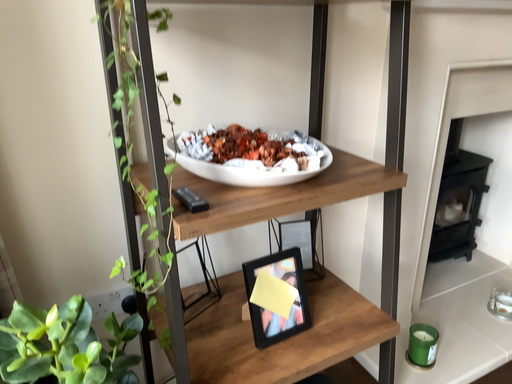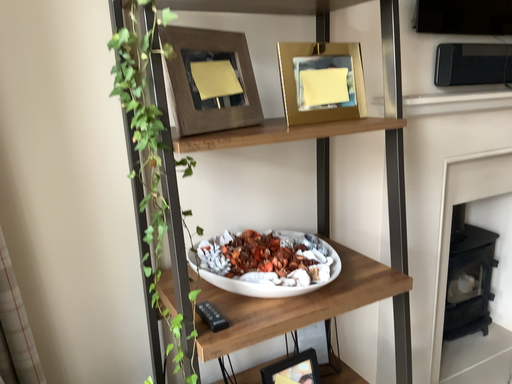
Question: How did the camera likely rotate when shooting the video?

Choices:
 (A) rotated upward
 (B) rotated downward

Answer: (A)